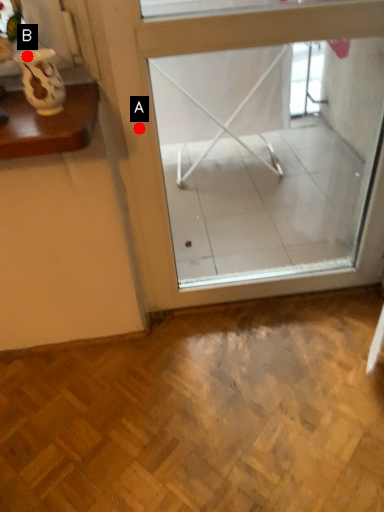
Question: Two points are circled on the image, labeled by A and B beside each circle. Which point is farther to the camera?

Choices:
 (A) A is further
 (B) B is further

Answer: (A)